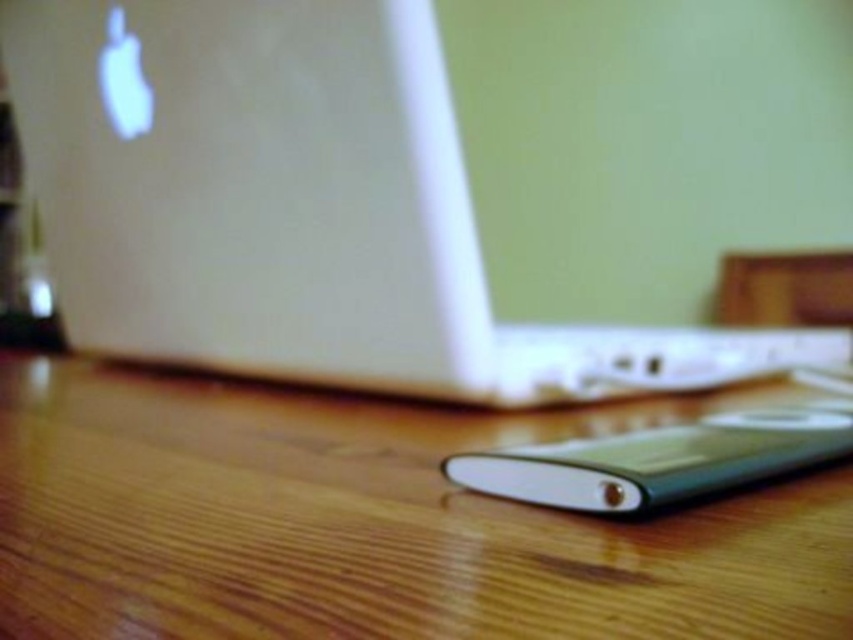
Question: Where is white glossy laptop at center located in relation to wooden table at lower center in the image?

Choices:
 (A) above
 (B) below

Answer: (A)

Question: Among these points, which one is nearest to the camera?

Choices:
 (A) (189, 609)
 (B) (552, 344)

Answer: (A)

Question: Which point is farther to the camera?

Choices:
 (A) wooden table at lower center
 (B) white glossy laptop at center

Answer: (B)

Question: Can you confirm if white glossy laptop at center is positioned below wooden table at lower center?

Choices:
 (A) no
 (B) yes

Answer: (A)

Question: Is white glossy laptop at center to the left of wooden table at lower center from the viewer's perspective?

Choices:
 (A) yes
 (B) no

Answer: (B)